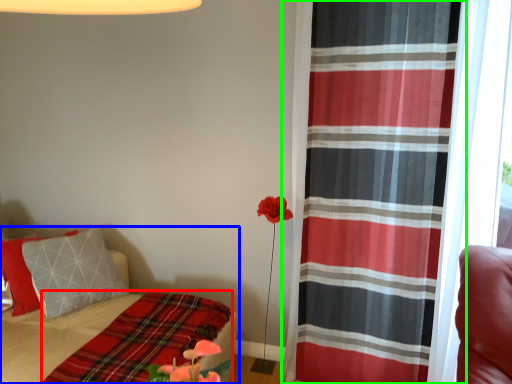
Question: Which object is positioned closest to blanket (highlighted by a red box)? Select from bed (highlighted by a blue box) and curtain (highlighted by a green box).

Choices:
 (A) bed
 (B) curtain

Answer: (A)